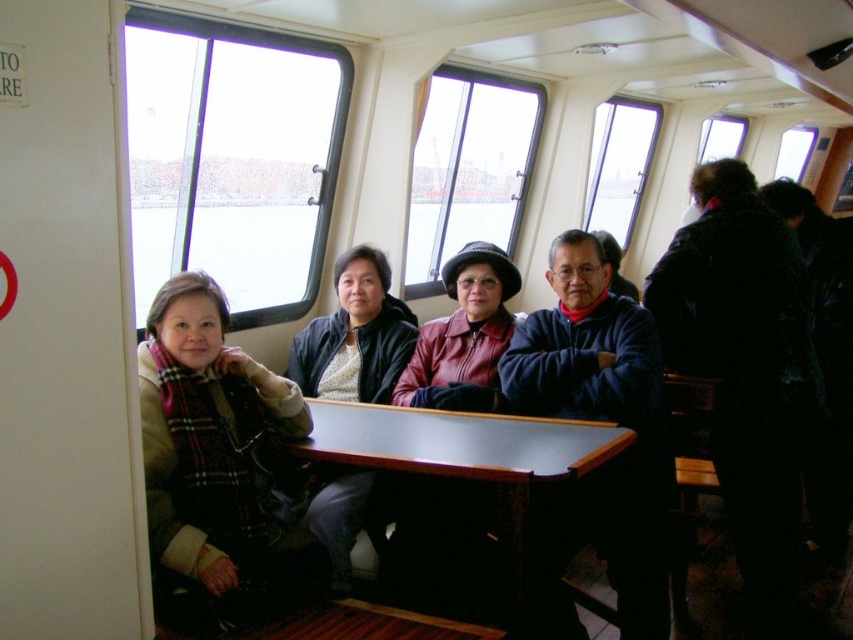
Looking at this image, you are a passenger on the boat and want to hand a document to the person wearing the blue fleece jacket at center. The document is on the plaid scarf at left. Can you reach it without moving either item?

The plaid scarf at left is positioned on the left side of blue fleece jacket at center, so the document on the plaid scarf at left is within reach of the person wearing the blue fleece jacket at center.

You are a passenger on the boat and need to retrieve your plaid scarf at left. The blue fleece jacket at center is blocking your path. Can you reach your scarf without moving the jacket?

The plaid scarf at left is in front of the blue fleece jacket at center, so you can reach the plaid scarf at left without moving the jacket because it is already in front.